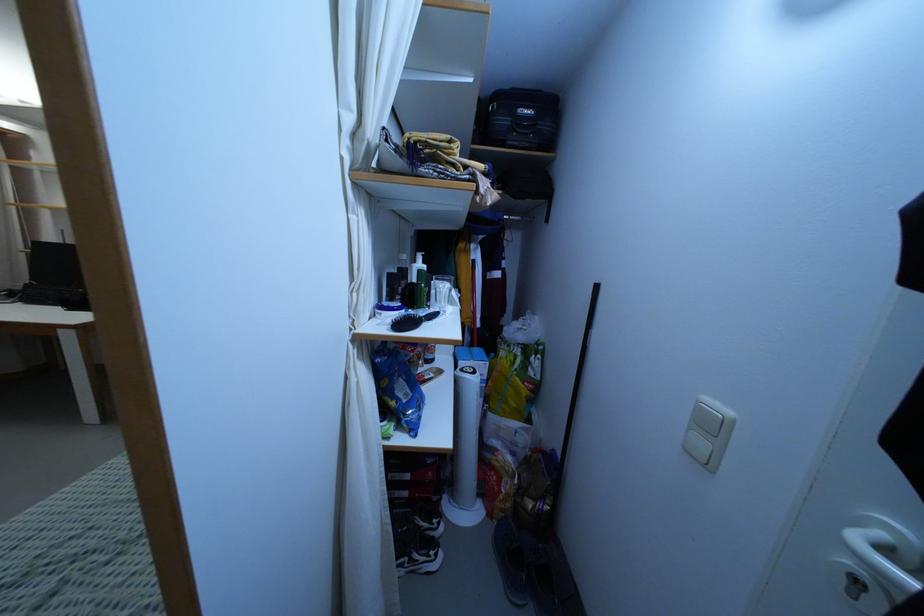
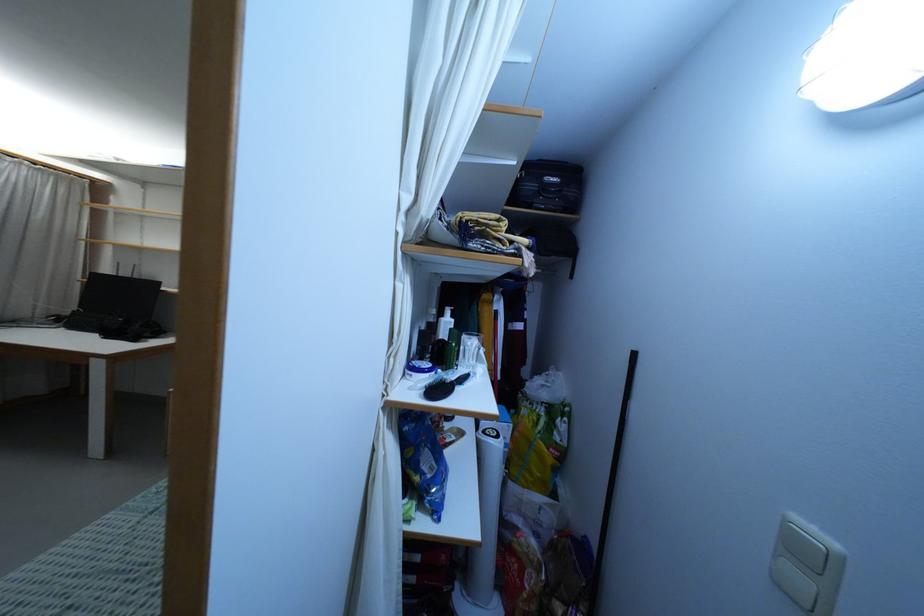
In the second image, find the point that corresponds to (x=424, y=265) in the first image.

(453, 320)